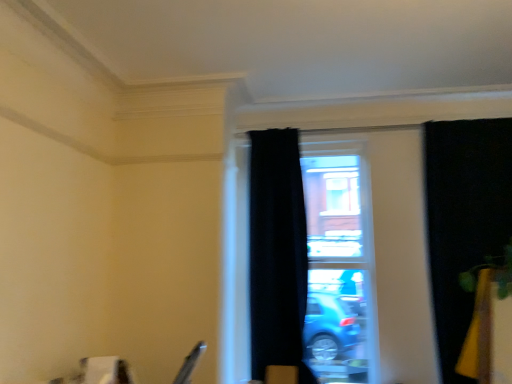
I want to click on black velvet curtain at center, which is the 2th curtain in right-to-left order, so click(277, 253).

Identify the location of transparent glass window at center. This screenshot has height=384, width=512. (370, 253).

Image resolution: width=512 pixels, height=384 pixels. What are the coordinates of `the 2nd curtain positioned above the transparent glass window at center (from the image's perspective)` in the screenshot? It's located at (464, 217).

From the picture: Is transparent glass window at center not inside black velvet curtain at right, which is the 2th curtain in left-to-right order?

Yes, transparent glass window at center is not within black velvet curtain at right, which is the 2th curtain in left-to-right order.

Considering the relative sizes of transparent glass window at center and black velvet curtain at right, which is the 2th curtain in left-to-right order, in the image provided, is transparent glass window at center taller than black velvet curtain at right, which is the 2th curtain in left-to-right order,?

Yes, transparent glass window at center is taller than black velvet curtain at right, which is the 2th curtain in left-to-right order.

From a real-world perspective, is transparent glass window at center positioned above or below black velvet curtain at right, which is the 2th curtain in left-to-right order?

From a real-world perspective, transparent glass window at center is physically below black velvet curtain at right, which is the 2th curtain in left-to-right order.

Considering the sizes of objects black velvet curtain at center, which is the 2th curtain in right-to-left order, and black velvet curtain at right, which is the 2th curtain in left-to-right order, in the image provided, who is shorter, black velvet curtain at center, which is the 2th curtain in right-to-left order, or black velvet curtain at right, which is the 2th curtain in left-to-right order,?

With less height is black velvet curtain at right, which is the 2th curtain in left-to-right order.

Consider the image. Does black velvet curtain at center, which is the 2th curtain in right-to-left order, lie in front of black velvet curtain at right, which is the 2th curtain in left-to-right order?

That is False.

From the image's perspective, which is below, black velvet curtain at center, arranged as the 1th curtain when viewed from the left, or black velvet curtain at right, which is the 1th curtain in right-to-left order?

From the image's view, black velvet curtain at center, arranged as the 1th curtain when viewed from the left, is below.

Is black velvet curtain at center, which is the 2th curtain in right-to-left order, thinner than transparent glass window at center?

No.

Looking at this image, is black velvet curtain at center, which is the 2th curtain in right-to-left order, not close to transparent glass window at center?

No, black velvet curtain at center, which is the 2th curtain in right-to-left order, is not far from transparent glass window at center.

Which object is further away from the camera, black velvet curtain at center, which is the 2th curtain in right-to-left order, or transparent glass window at center?

transparent glass window at center is further from the camera.

Which is in front, point (502, 209) or point (242, 347)?

The point (502, 209) is closer.

Which object is closer to the camera taking this photo, black velvet curtain at right, which is the 1th curtain in right-to-left order, or transparent glass window at center?

Positioned in front is black velvet curtain at right, which is the 1th curtain in right-to-left order.

From a real-world perspective, is black velvet curtain at right, which is the 2th curtain in left-to-right order, positioned over transparent glass window at center based on gravity?

Yes.

Which of these two, black velvet curtain at right, which is the 1th curtain in right-to-left order, or transparent glass window at center, stands taller?

With more height is transparent glass window at center.

Is black velvet curtain at right, which is the 2th curtain in left-to-right order, completely or partially outside of black velvet curtain at center, arranged as the 1th curtain when viewed from the left?

Absolutely, black velvet curtain at right, which is the 2th curtain in left-to-right order, is external to black velvet curtain at center, arranged as the 1th curtain when viewed from the left.

Is black velvet curtain at right, which is the 2th curtain in left-to-right order, to the left or to the right of black velvet curtain at center, arranged as the 1th curtain when viewed from the left, in the image?

black velvet curtain at right, which is the 2th curtain in left-to-right order, is to the right of black velvet curtain at center, arranged as the 1th curtain when viewed from the left.

From the image's perspective, which is below, black velvet curtain at right, which is the 2th curtain in left-to-right order, or black velvet curtain at center, which is the 2th curtain in right-to-left order?

black velvet curtain at center, which is the 2th curtain in right-to-left order.

From a real-world perspective, which curtain is the 1st one above the transparent glass window at center? Please provide its 2D coordinates.

[(277, 253)]

Considering the relative sizes of transparent glass window at center and black velvet curtain at center, arranged as the 1th curtain when viewed from the left, in the image provided, is transparent glass window at center bigger than black velvet curtain at center, arranged as the 1th curtain when viewed from the left,?

Correct, transparent glass window at center is larger in size than black velvet curtain at center, arranged as the 1th curtain when viewed from the left.

From a real-world perspective, which object stands above the other?

black velvet curtain at center, arranged as the 1th curtain when viewed from the left, is physically above.

Does point (360, 222) appear closer or farther from the camera than point (263, 327)?

Point (360, 222) appears to be farther away from the viewer than point (263, 327).

You are a GUI agent. You are given a task and a screenshot of the screen. Output one action in this format:
    pyautogui.click(x=<x>, y=<y>)
    Task: Click on the 2nd curtain above the transparent glass window at center (from a real-world perspective)
    This screenshot has height=384, width=512.
    Given the screenshot: What is the action you would take?
    pyautogui.click(x=464, y=217)

Image resolution: width=512 pixels, height=384 pixels. I want to click on curtain that is under the black velvet curtain at right, which is the 2th curtain in left-to-right order (from a real-world perspective), so click(x=277, y=253).

Estimate the real-world distances between objects in this image. Which object is further from transparent glass window at center, black velvet curtain at center, arranged as the 1th curtain when viewed from the left, or black velvet curtain at right, which is the 2th curtain in left-to-right order?

black velvet curtain at center, arranged as the 1th curtain when viewed from the left.

From the image, which object appears to be farther from black velvet curtain at center, which is the 2th curtain in right-to-left order, black velvet curtain at right, which is the 1th curtain in right-to-left order, or transparent glass window at center?

black velvet curtain at right, which is the 1th curtain in right-to-left order, is further to black velvet curtain at center, which is the 2th curtain in right-to-left order.

Which object lies nearer to the anchor point transparent glass window at center, black velvet curtain at right, which is the 1th curtain in right-to-left order, or black velvet curtain at center, arranged as the 1th curtain when viewed from the left?

black velvet curtain at right, which is the 1th curtain in right-to-left order, lies closer to transparent glass window at center than the other object.

Which object lies further to the anchor point black velvet curtain at center, which is the 2th curtain in right-to-left order, transparent glass window at center or black velvet curtain at right, which is the 1th curtain in right-to-left order?

Among the two, black velvet curtain at right, which is the 1th curtain in right-to-left order, is located further to black velvet curtain at center, which is the 2th curtain in right-to-left order.

From the image, which object appears to be nearer to black velvet curtain at right, which is the 1th curtain in right-to-left order, transparent glass window at center or black velvet curtain at center, which is the 2th curtain in right-to-left order?

transparent glass window at center is closer to black velvet curtain at right, which is the 1th curtain in right-to-left order.

When comparing their distances from black velvet curtain at right, which is the 1th curtain in right-to-left order, does black velvet curtain at center, arranged as the 1th curtain when viewed from the left, or transparent glass window at center seem closer?

The object closer to black velvet curtain at right, which is the 1th curtain in right-to-left order, is transparent glass window at center.

You are a GUI agent. You are given a task and a screenshot of the screen. Output one action in this format:
    pyautogui.click(x=<x>, y=<y>)
    Task: Click on the window situated between black velvet curtain at center, arranged as the 1th curtain when viewed from the left, and black velvet curtain at right, which is the 2th curtain in left-to-right order, from left to right
    The image size is (512, 384).
    Given the screenshot: What is the action you would take?
    pyautogui.click(x=370, y=253)